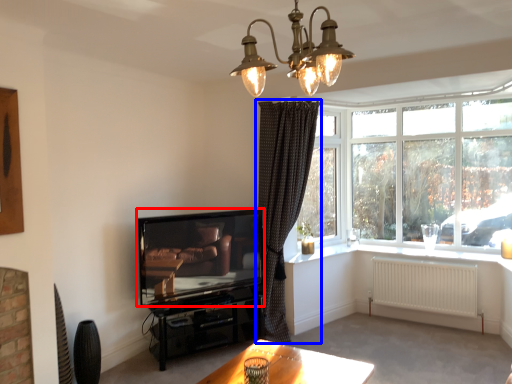
Question: Which object appears farthest to the camera in this image, television (highlighted by a red box) or curtain (highlighted by a blue box)?

Choices:
 (A) television
 (B) curtain

Answer: (B)